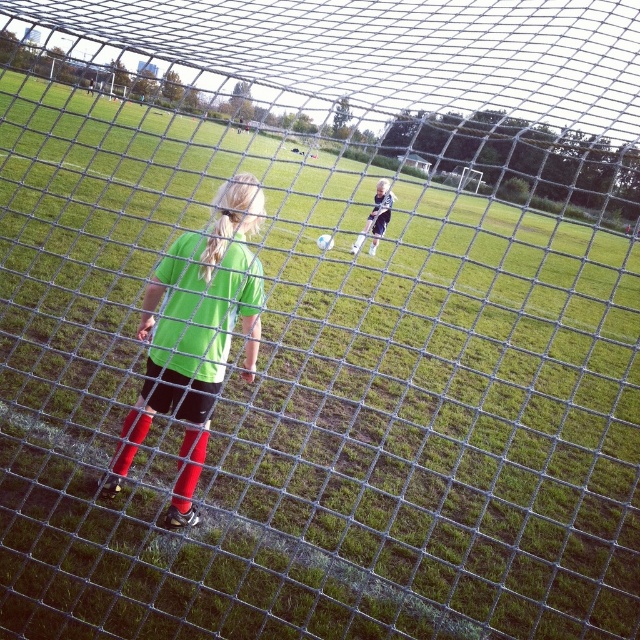
In the scene shown: Does green matte shirt at center come behind dark blue jersey at center?

No, green matte shirt at center is in front of dark blue jersey at center.

Based on the photo, does green matte shirt at center have a greater height compared to dark blue jersey at center?

In fact, green matte shirt at center may be shorter than dark blue jersey at center.

Between point (198, 461) and point (380, 224), which one is positioned in front?

Positioned in front is point (198, 461).

Where is `green matte shirt at center`? Image resolution: width=640 pixels, height=640 pixels. green matte shirt at center is located at coordinates click(196, 333).